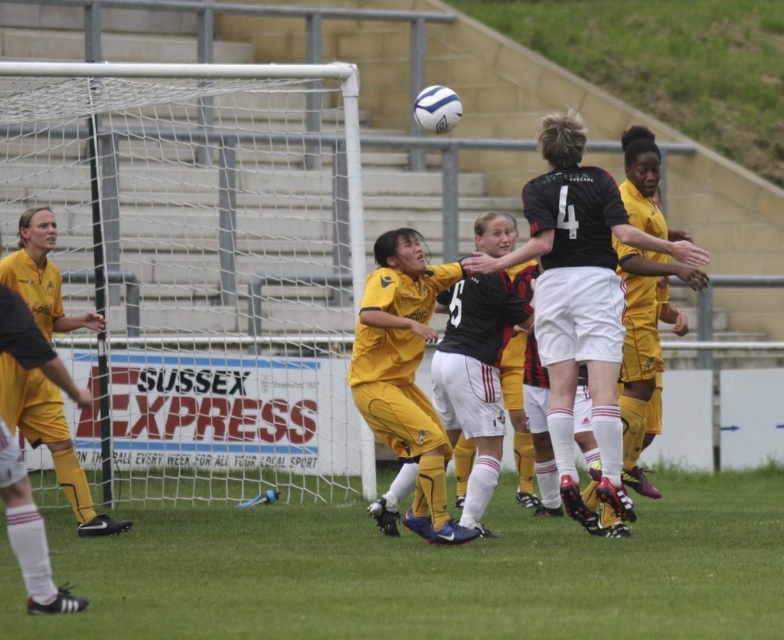
You are a soccer referee observing the play. You need to determine if the ball crossed the goal line. The goal line is located at the position of point (196, 628). The ball was last seen at point (234, 429). Based on their positions, did the ball cross the goal line?

Point (234, 429) is further to the camera than point (196, 628). Since the ball was last seen at point (234, 429), which is behind the goal line position of point (196, 628), the ball did not cross the goal line.

You are a soccer referee watching the match. You need to determine if the ball was handled by the goalkeeper. The ball is at point (579,294). Is the ball touching the yellow jersey at center?

The point (579,294) is on the yellow jersey at center, so the ball was touching the goalkeeper.